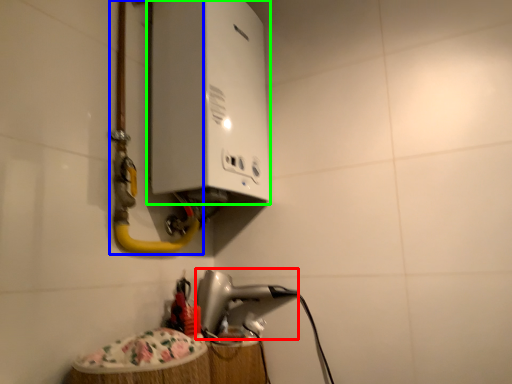
Question: Which is nearer to the appliance (highlighted by a red box)? water pipe (highlighted by a blue box) or appliance (highlighted by a green box).

Choices:
 (A) water pipe
 (B) appliance

Answer: (A)